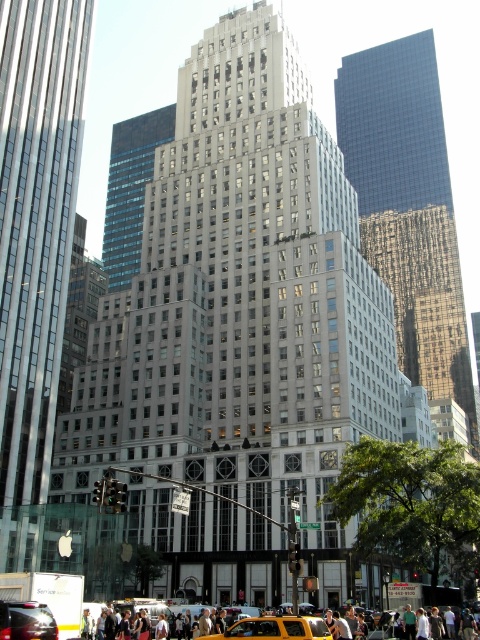
Is yellow matte taxi at center shorter than shiny black car at lower left?

Incorrect, yellow matte taxi at center's height does not fall short of shiny black car at lower left's.

Is point (213, 634) in front of point (35, 621)?

No, it is not.

Where is `yellow matte taxi at center`? Image resolution: width=480 pixels, height=640 pixels. yellow matte taxi at center is located at coordinates (274, 628).